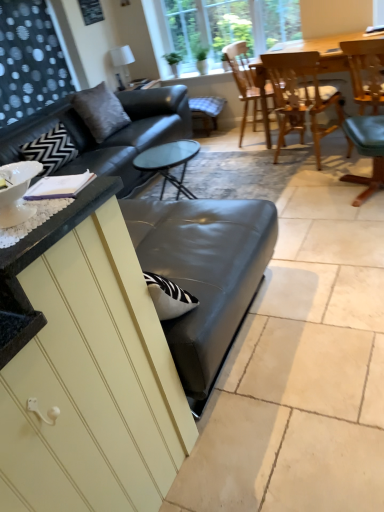
Question: Does wooden chair at upper right, which is counted as the 2th chair, starting from the left, have a lesser height compared to gray fabric pillow at upper left?

Choices:
 (A) no
 (B) yes

Answer: (A)

Question: Is wooden chair at upper right, which is the 2th chair from right to left, turned away from gray fabric pillow at upper left?

Choices:
 (A) no
 (B) yes

Answer: (A)

Question: Considering the relative sizes of wooden chair at upper right, which is counted as the 2th chair, starting from the left, and gray fabric pillow at upper left in the image provided, is wooden chair at upper right, which is counted as the 2th chair, starting from the left, smaller than gray fabric pillow at upper left?

Choices:
 (A) yes
 (B) no

Answer: (B)

Question: Is wooden chair at upper right, which is the 2th chair from right to left, in contact with gray fabric pillow at upper left?

Choices:
 (A) no
 (B) yes

Answer: (A)

Question: Does wooden chair at upper right, which is counted as the 2th chair, starting from the left, have a greater width compared to gray fabric pillow at upper left?

Choices:
 (A) yes
 (B) no

Answer: (A)

Question: Is wooden chair at upper right, which is counted as the 2th chair, starting from the left, oriented towards gray fabric pillow at upper left?

Choices:
 (A) no
 (B) yes

Answer: (A)

Question: Would you say gray fabric pillow at upper left is a long distance from checkered fabric bar stool at center?

Choices:
 (A) yes
 (B) no

Answer: (A)

Question: Does gray fabric pillow at upper left have a greater width compared to checkered fabric bar stool at center?

Choices:
 (A) yes
 (B) no

Answer: (B)

Question: Is gray fabric pillow at upper left oriented towards checkered fabric bar stool at center?

Choices:
 (A) yes
 (B) no

Answer: (B)

Question: Does gray fabric pillow at upper left appear on the right side of checkered fabric bar stool at center?

Choices:
 (A) yes
 (B) no

Answer: (B)

Question: From the image's perspective, does gray fabric pillow at upper left appear higher than checkered fabric bar stool at center?

Choices:
 (A) no
 (B) yes

Answer: (A)

Question: Considering the relative sizes of gray fabric pillow at upper left and checkered fabric bar stool at center in the image provided, is gray fabric pillow at upper left taller than checkered fabric bar stool at center?

Choices:
 (A) no
 (B) yes

Answer: (B)

Question: Is there a large distance between checkered fabric bar stool at center and clear glass window at upper center?

Choices:
 (A) yes
 (B) no

Answer: (B)